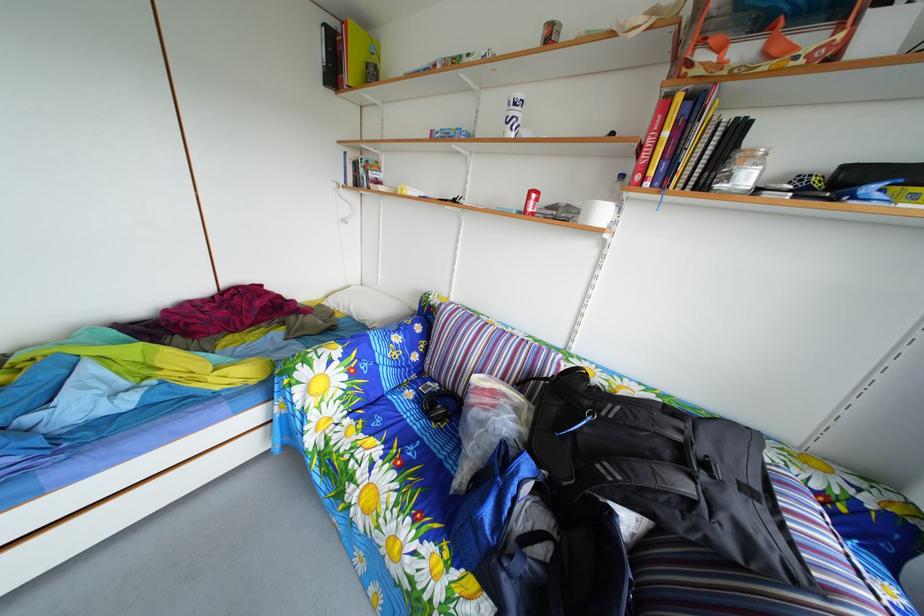
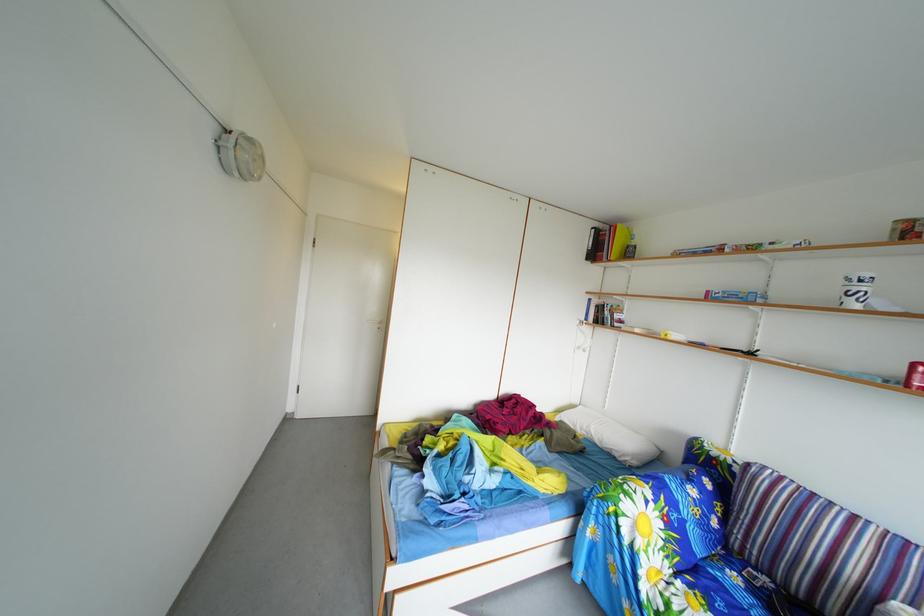
Where in the second image is the point corresponding to (420,402) from the first image?

(746, 585)